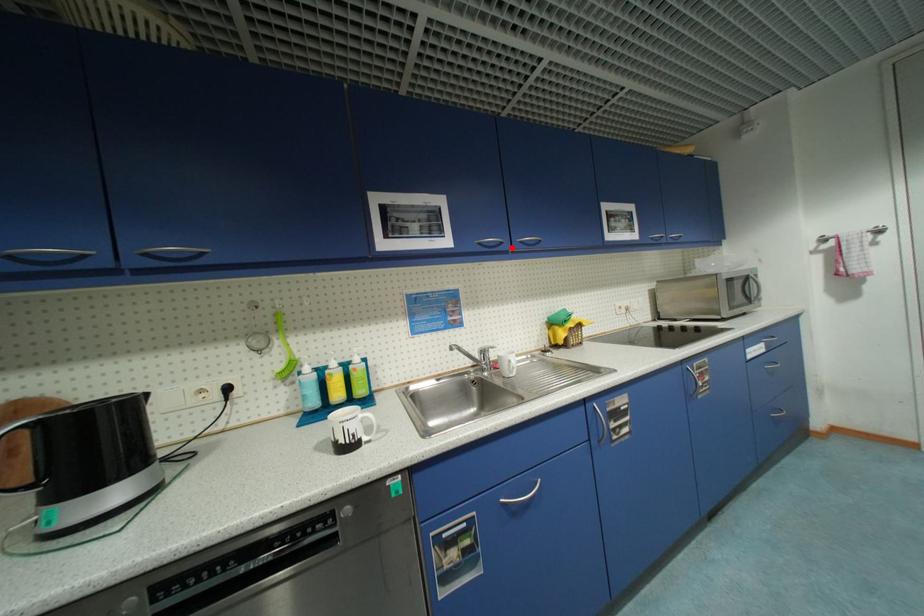
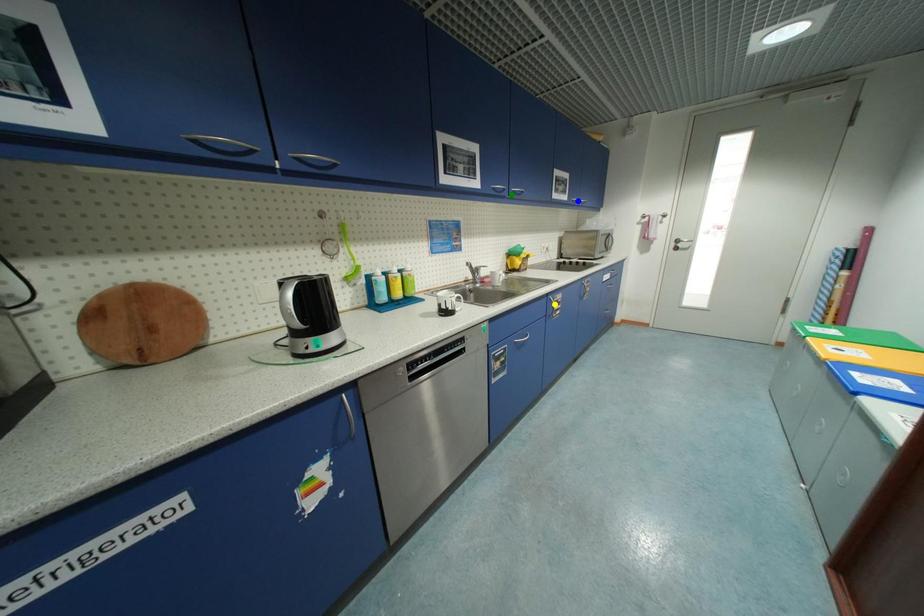
Question: I am providing you with two images of the same scene from different viewpoints. A red point is marked on the first image. You are given multiple points on the second image. Can you choose the point in image 2 that corresponds to the point in image 1?

Choices:
 (A) yellow point
 (B) blue point
 (C) green point

Answer: (C)